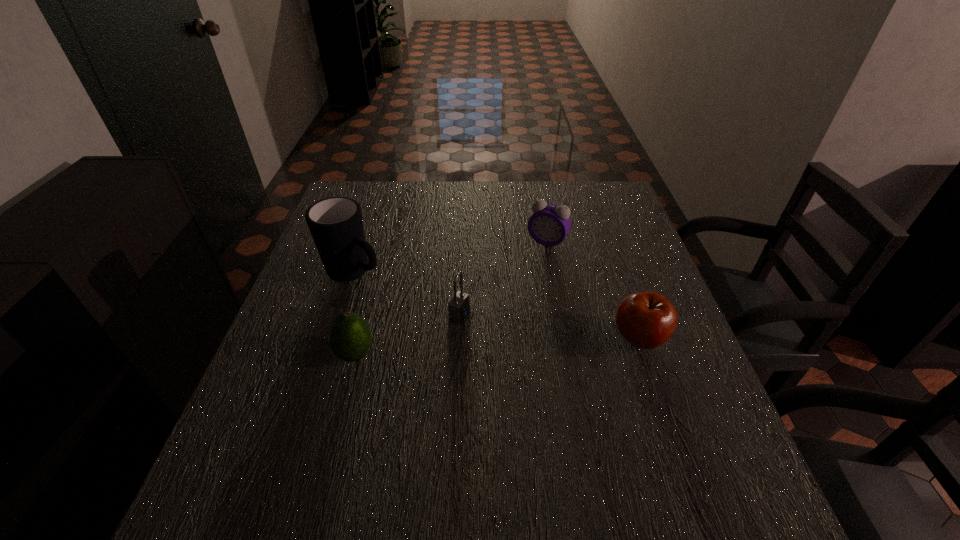
You are a GUI agent. You are given a task and a screenshot of the screen. Output one action in this format:
    pyautogui.click(x=<x>, y=<y>)
    Task: Click on the vacant space located on the side of the second farthest object with the handle
    
    Given the screenshot: What is the action you would take?
    pyautogui.click(x=421, y=309)

I want to click on vacant area situated 0.240m on the side of the second farthest object with the handle, so click(450, 326).

Locate an element on the screen. This screenshot has width=960, height=540. vacant area situated on the face of the fourth object from left to right is located at coordinates (495, 323).

The image size is (960, 540). I want to click on vacant space located 0.150m on the face of the fourth object from left to right, so click(519, 284).

This screenshot has height=540, width=960. Find the location of `free space located on the face of the fourth object from left to right`. free space located on the face of the fourth object from left to right is located at coordinates (482, 345).

The width and height of the screenshot is (960, 540). Find the location of `vacant space located on the shackle of the padlock`. vacant space located on the shackle of the padlock is located at coordinates (533, 343).

Locate an element on the screen. vacant area located on the shackle of the padlock is located at coordinates (528, 341).

Find the location of `vacant space located on the shackle of the padlock`. vacant space located on the shackle of the padlock is located at coordinates (637, 384).

The image size is (960, 540). In order to click on avocado located in the left edge section of the desktop in this screenshot , I will do `click(350, 338)`.

At what (x,y) coordinates should I click in order to perform the action: click on mug present at the left edge. Please return your answer as a coordinate pair (x, y). Looking at the image, I should click on coord(336,224).